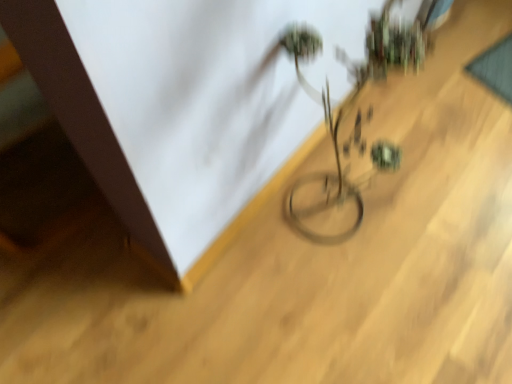
Where is `vacant region to the right of green matte houseplant at center`? The image size is (512, 384). vacant region to the right of green matte houseplant at center is located at coordinates (410, 220).